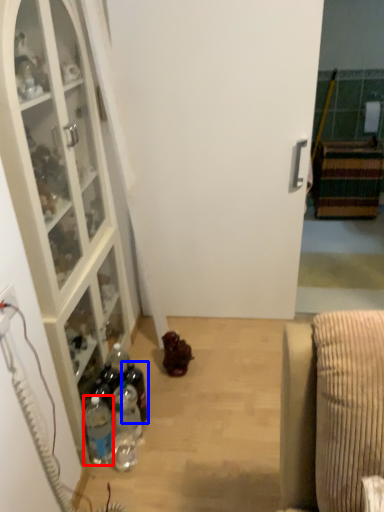
Question: Which object is closer to the camera taking this photo, bottle (highlighted by a red box) or bottle (highlighted by a blue box)?

Choices:
 (A) bottle
 (B) bottle

Answer: (A)